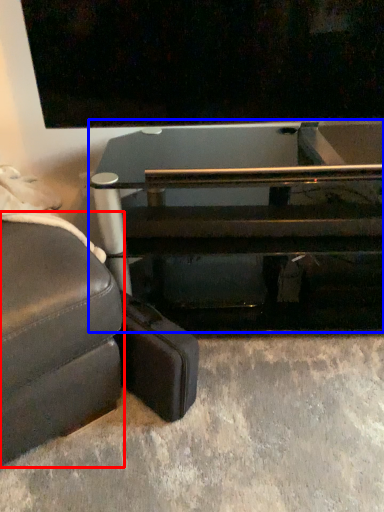
Question: Which object is closer to the camera taking this photo, studio couch (highlighted by a red box) or table (highlighted by a blue box)?

Choices:
 (A) studio couch
 (B) table

Answer: (A)